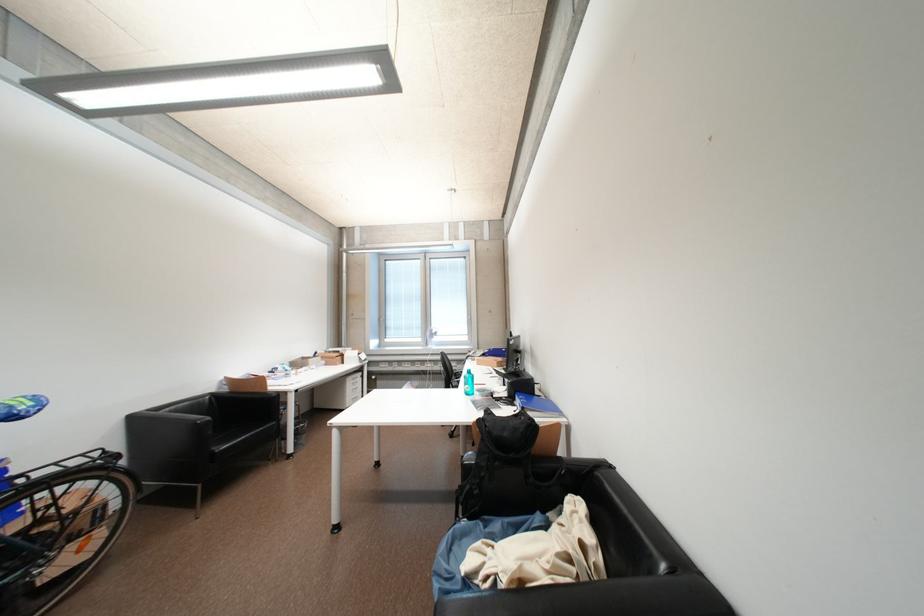
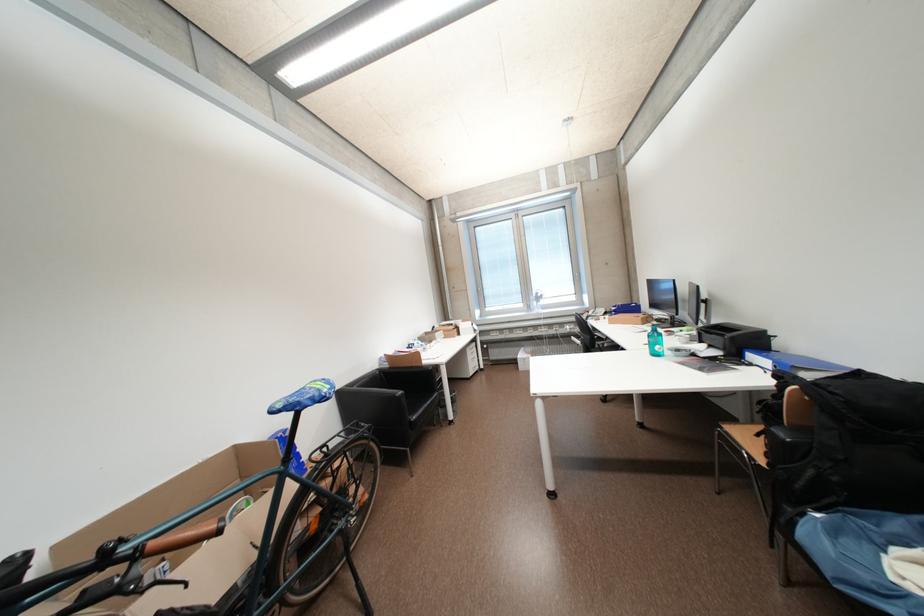
Locate, in the second image, the point that corresponds to pixel 264 392 in the first image.

(421, 367)